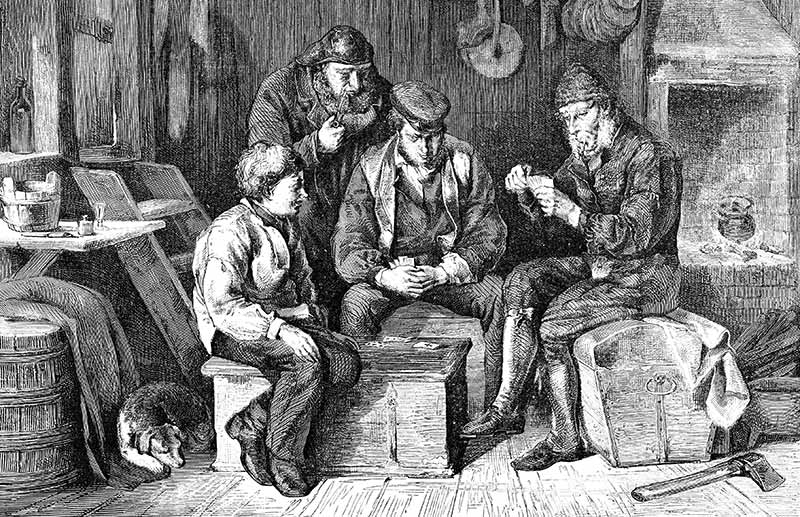
The height and width of the screenshot is (517, 800). I want to click on ladder, so (x=152, y=264).